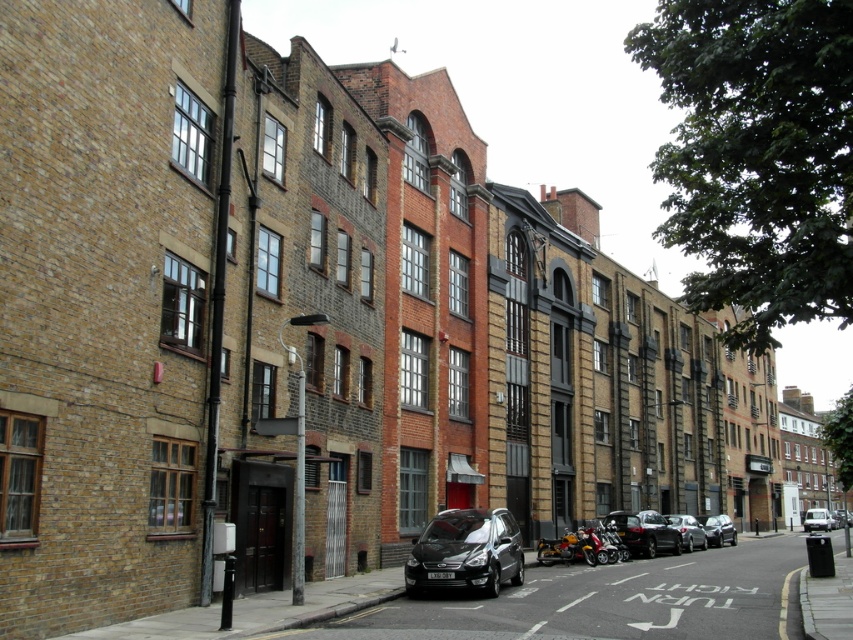
Is silver metallic car at center below silver metallic van at center?

Incorrect, silver metallic car at center is not positioned below silver metallic van at center.

Measure the distance between silver metallic car at center and camera.

They are 256.54 feet apart.

What do you see at coordinates (718, 529) in the screenshot? I see `silver metallic car at center` at bounding box center [718, 529].

The height and width of the screenshot is (640, 853). I want to click on silver metallic car at center, so click(718, 529).

Is black metallic car at center positioned at the back of shiny black car at center?

No, it is not.

Is black metallic car at center shorter than shiny black car at center?

No.

At what (x,y) coordinates should I click in order to perform the action: click on black metallic car at center. Please return your answer as a coordinate pair (x, y). This screenshot has height=640, width=853. Looking at the image, I should click on (466, 552).

Where is `black metallic van at center`? This screenshot has width=853, height=640. black metallic van at center is located at coordinates (605, 602).

The width and height of the screenshot is (853, 640). I want to click on black metallic van at center, so click(605, 602).